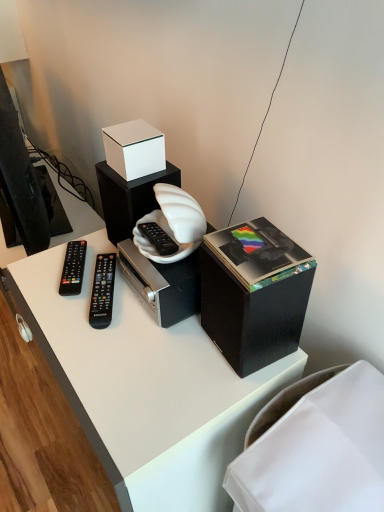
Question: From a real-world perspective, is black plastic remote at left, marked as the 2th remote control in a right-to-left arrangement, physically located above or below white matte speaker at center?

Choices:
 (A) below
 (B) above

Answer: (A)

Question: Is black plastic remote at left, marked as the 2th remote control in a right-to-left arrangement, situated inside white matte speaker at center or outside?

Choices:
 (A) outside
 (B) inside

Answer: (A)

Question: Estimate the real-world distances between objects in this image. Which object is closer to the white matte speaker at center?

Choices:
 (A) black plastic remote at center, the first remote control from the right
 (B) white fabric at lower right
 (C) black plastic remote at left, the first remote control viewed from the left
 (D) black matte file cabinet at upper right
 (E) white matte box at upper center

Answer: (E)

Question: Based on their relative distances, which object is farther from the black matte file cabinet at upper right?

Choices:
 (A) white matte box at upper center
 (B) black plastic remote at center, the first remote control from the right
 (C) white matte speaker at center
 (D) white fabric at lower right
 (E) black plastic remote at left, the first remote control viewed from the left

Answer: (E)